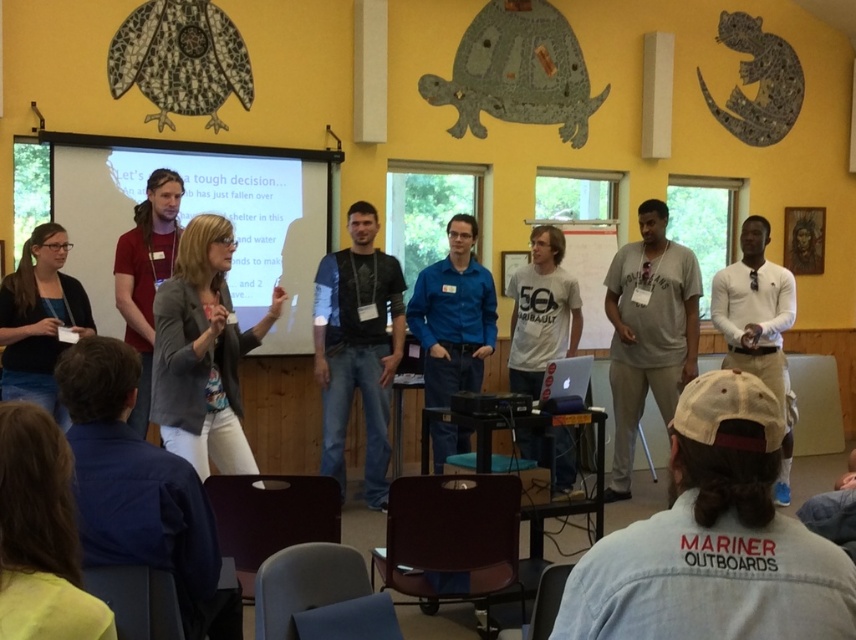
Can you confirm if dark brown leather jacket at left is smaller than silver metallic laptop at center?

No.

Looking at this image, who is lower down, dark brown leather jacket at left or silver metallic laptop at center?

silver metallic laptop at center is lower down.

Identify the location of dark brown leather jacket at left. (146, 275).

Identify the location of dark brown leather jacket at left. (146, 275).

Is white paper at center wider than silver metallic laptop at center?

Yes.

Is point (599, 266) positioned behind point (557, 396)?

Yes, it is.

The width and height of the screenshot is (856, 640). Describe the element at coordinates (587, 272) in the screenshot. I see `white paper at center` at that location.

Where is `white paper at center`? The height and width of the screenshot is (640, 856). white paper at center is located at coordinates (587, 272).

Is black matte shirt at center positioned behind dark brown leather jacket at left?

That is True.

Is black matte shirt at center shorter than dark brown leather jacket at left?

Incorrect, black matte shirt at center's height does not fall short of dark brown leather jacket at left's.

Between point (351, 396) and point (129, 234), which one is positioned behind?

The point (351, 396) is behind.

This screenshot has height=640, width=856. I want to click on black matte shirt at center, so click(357, 348).